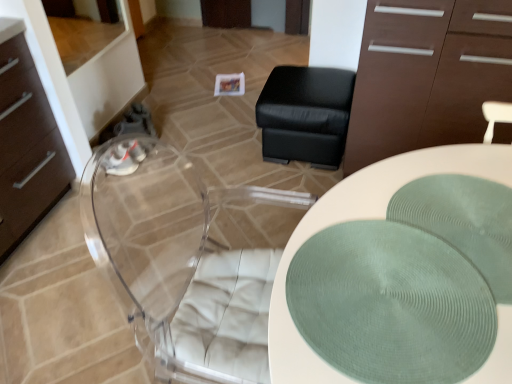
What do you see at coordinates (464, 221) in the screenshot? I see `green textured placemat at center` at bounding box center [464, 221].

Image resolution: width=512 pixels, height=384 pixels. Describe the element at coordinates (359, 219) in the screenshot. I see `white textured placemat at center` at that location.

Find the location of a particular element. This screenshot has width=512, height=384. green textured placemat at center is located at coordinates [464, 221].

In terms of height, does transparent acrylic swivel chair at center look taller or shorter compared to white textured placemat at center?

In the image, transparent acrylic swivel chair at center appears to be shorter than white textured placemat at center.

Is transparent acrylic swivel chair at center bigger than white textured placemat at center?

No.

From the image's perspective, which one is positioned higher, transparent acrylic swivel chair at center or white textured placemat at center?

transparent acrylic swivel chair at center.

Is transparent acrylic swivel chair at center turned away from white textured placemat at center?

No, transparent acrylic swivel chair at center is not facing away from white textured placemat at center.

Is white textured placemat at center facing towards green textured placemat at center?

No, white textured placemat at center does not turn towards green textured placemat at center.

Would you say green textured placemat at center is part of white textured placemat at center's contents?

Yes, white textured placemat at center is surrounding green textured placemat at center.

From a real-world perspective, which is physically below, white textured placemat at center or green textured placemat at center?

white textured placemat at center.

Is white textured placemat at center wider than green textured placemat at center?

Yes, white textured placemat at center is wider than green textured placemat at center.

Based on the photo, which of these two, black leather ottoman at center or transparent acrylic swivel chair at center, is thinner?

Thinner between the two is black leather ottoman at center.

Which object is closer to the camera, black leather ottoman at center or transparent acrylic swivel chair at center?

transparent acrylic swivel chair at center.

Between black leather ottoman at center and transparent acrylic swivel chair at center, which one has more height?

black leather ottoman at center.

From a real-world perspective, is black leather ottoman at center beneath transparent acrylic swivel chair at center?

Incorrect, from a real-world perspective, black leather ottoman at center is higher than transparent acrylic swivel chair at center.

In order to click on cabinetry above the transparent acrylic swivel chair at center (from a real-world perspective) in this screenshot , I will do `click(426, 75)`.

How much distance is there between brown matte cabinet at upper right and transparent acrylic swivel chair at center?

brown matte cabinet at upper right is 30.13 inches from transparent acrylic swivel chair at center.

From the image's perspective, would you say brown matte cabinet at upper right is shown under transparent acrylic swivel chair at center?

Incorrect, from the image's perspective, brown matte cabinet at upper right is higher than transparent acrylic swivel chair at center.

Is brown matte cabinet at upper right wider or thinner than transparent acrylic swivel chair at center?

brown matte cabinet at upper right is thinner than transparent acrylic swivel chair at center.

Is green textured placemat at center placed right next to black leather ottoman at center?

No, green textured placemat at center is not making contact with black leather ottoman at center.

From their relative heights in the image, would you say green textured placemat at center is taller or shorter than black leather ottoman at center?

Clearly, green textured placemat at center is shorter compared to black leather ottoman at center.

From a real-world perspective, is green textured placemat at center positioned above or below black leather ottoman at center?

From a real-world perspective, green textured placemat at center is physically above black leather ottoman at center.

From the image's perspective, does brown matte cabinet at upper right appear higher than white textured placemat at center?

Yes.

Which object is positioned more to the right, brown matte cabinet at upper right or white textured placemat at center?

From the viewer's perspective, brown matte cabinet at upper right appears more on the right side.

Is point (352, 158) behind point (509, 333)?

Yes.

Which of these two, brown matte cabinet at upper right or white textured placemat at center, is wider?

Wider between the two is white textured placemat at center.

From the image's perspective, is brown matte cabinet at upper right under green textured placemat at center?

No, from the image's perspective, brown matte cabinet at upper right is not below green textured placemat at center.

Which object is wider, brown matte cabinet at upper right or green textured placemat at center?

brown matte cabinet at upper right.

Is brown matte cabinet at upper right turned away from green textured placemat at center?

That's not correct — brown matte cabinet at upper right is not looking away from green textured placemat at center.

Visually, is brown matte cabinet at upper right positioned to the left or to the right of green textured placemat at center?

Clearly, brown matte cabinet at upper right is on the right of green textured placemat at center in the image.

The height and width of the screenshot is (384, 512). I want to click on desk in front of the transparent acrylic swivel chair at center, so click(x=359, y=219).

In order to click on mat that is behind the white textured placemat at center in this screenshot , I will do `click(464, 221)`.

In the scene shown: Estimate the real-world distances between objects in this image. Which object is closer to white textured placemat at center, green textured placemat at center or brown matte cabinet at upper right?

The object closer to white textured placemat at center is green textured placemat at center.

Based on their spatial positions, is transparent acrylic swivel chair at center or white textured placemat at center further from brown matte cabinet at upper right?

transparent acrylic swivel chair at center is further to brown matte cabinet at upper right.

When comparing their distances from brown matte cabinet at upper right, does transparent acrylic swivel chair at center or green textured placemat at center seem closer?

Among the two, transparent acrylic swivel chair at center is located nearer to brown matte cabinet at upper right.

When comparing their distances from brown matte cabinet at upper right, does black leather ottoman at center or white textured placemat at center seem further?

white textured placemat at center is further to brown matte cabinet at upper right.

Looking at the image, which one is located further to brown matte cabinet at upper right, green textured placemat at center or transparent acrylic swivel chair at center?

The object further to brown matte cabinet at upper right is green textured placemat at center.

Which object lies nearer to the anchor point transparent acrylic swivel chair at center, green textured placemat at center or white textured placemat at center?

The object closer to transparent acrylic swivel chair at center is white textured placemat at center.

Looking at the image, which one is located further to transparent acrylic swivel chair at center, brown matte cabinet at upper right or white textured placemat at center?

white textured placemat at center is positioned further to the anchor transparent acrylic swivel chair at center.

Looking at the image, which one is located closer to black leather ottoman at center, white textured placemat at center or brown matte cabinet at upper right?

brown matte cabinet at upper right.

Locate an element on the screen. The height and width of the screenshot is (384, 512). desk situated between transparent acrylic swivel chair at center and brown matte cabinet at upper right from left to right is located at coordinates (359, 219).

You are a GUI agent. You are given a task and a screenshot of the screen. Output one action in this format:
    pyautogui.click(x=<x>, y=<y>)
    Task: Click on the cabinetry between green textured placemat at center and black leather ottoman at center from front to back
    The image size is (512, 384).
    Given the screenshot: What is the action you would take?
    pyautogui.click(x=426, y=75)

This screenshot has height=384, width=512. Identify the location of swivel chair between green textured placemat at center and black leather ottoman at center from front to back. (187, 258).

Find the location of a particular element. The width and height of the screenshot is (512, 384). mat located between transparent acrylic swivel chair at center and brown matte cabinet at upper right in the left-right direction is located at coordinates (464, 221).